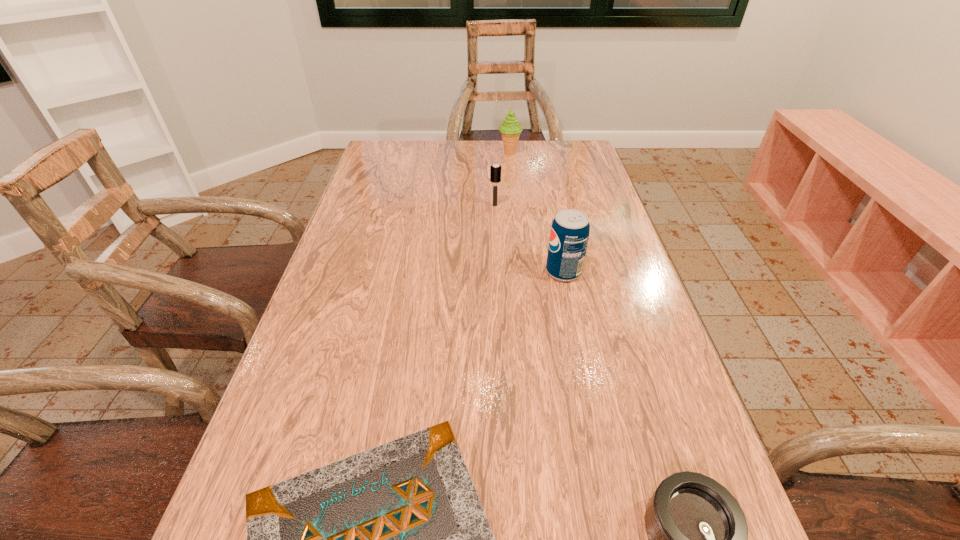
The height and width of the screenshot is (540, 960). I want to click on vacant space at the far edge of the desktop, so click(x=434, y=145).

Find the location of `free space at the left edge of the desktop`. free space at the left edge of the desktop is located at coordinates (345, 248).

This screenshot has width=960, height=540. I want to click on vacant space at the right edge, so click(604, 264).

You are a GUI agent. You are given a task and a screenshot of the screen. Output one action in this format:
    pyautogui.click(x=<x>, y=<y>)
    Task: Click on the vacant space at the far right corner of the desktop
    
    Given the screenshot: What is the action you would take?
    pyautogui.click(x=588, y=172)

At what (x,y) coordinates should I click in order to perform the action: click on free space between the hairbrush and the pop. Please return your answer as a coordinate pair (x, y). The image size is (960, 540). Looking at the image, I should click on (529, 238).

You are a GUI agent. You are given a task and a screenshot of the screen. Output one action in this format:
    pyautogui.click(x=<x>, y=<y>)
    Task: Click on the empty location between the third farthest object and the third object from left to right
    This screenshot has width=960, height=540.
    Given the screenshot: What is the action you would take?
    pyautogui.click(x=537, y=212)

Locate an element on the screen. The width and height of the screenshot is (960, 540). free point between the fourth nearest object and the third object from right to left is located at coordinates click(502, 179).

Select which object appears as the closest to the fourth tallest object. Please provide its 2D coordinates. Your answer should be formatted as a tuple, i.e. [(x, y)], where the tuple contains the x and y coordinates of a point satisfying the conditions above.

[(394, 539)]

Identify the location of the second closest object relative to the pop. (394, 539).

You are a GUI agent. You are given a task and a screenshot of the screen. Output one action in this format:
    pyautogui.click(x=<x>, y=<y>)
    Task: Click on the vacant space that satisfies the following two spatial constraints: 1. on the back side of the second farthest object; 2. on the right side of the farthest object
    The image size is (960, 540).
    Given the screenshot: What is the action you would take?
    pyautogui.click(x=492, y=153)